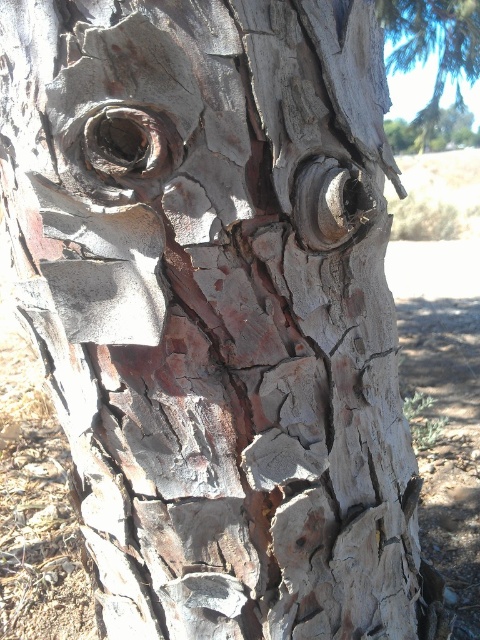
Between point (412, 38) and point (415, 129), which one is positioned behind?

The point (415, 129) is more distant.

Does cracked bark tree trunk at upper right have a larger size compared to cracked bark tree trunk at center?

Yes.

Is point (467, 6) farther from viewer compared to point (456, 140)?

No, (467, 6) is closer to viewer.

Identify the location of cracked bark tree trunk at upper right. The image size is (480, 640). (432, 45).